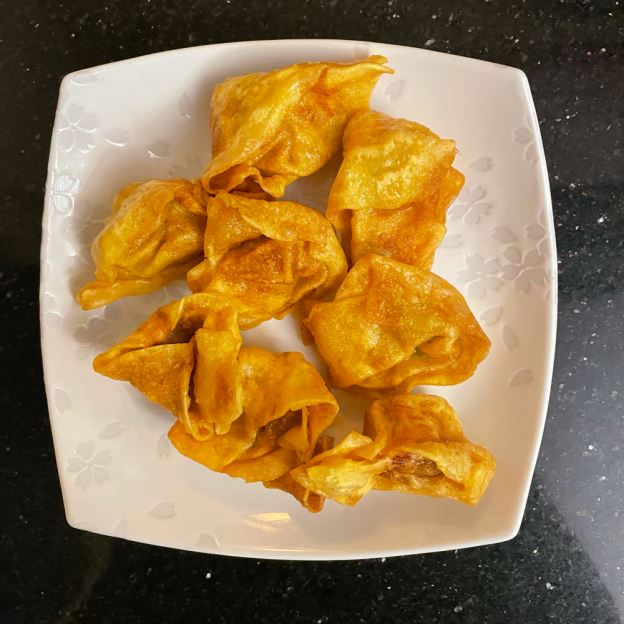
The image size is (624, 624). I want to click on black table, so click(x=550, y=592).